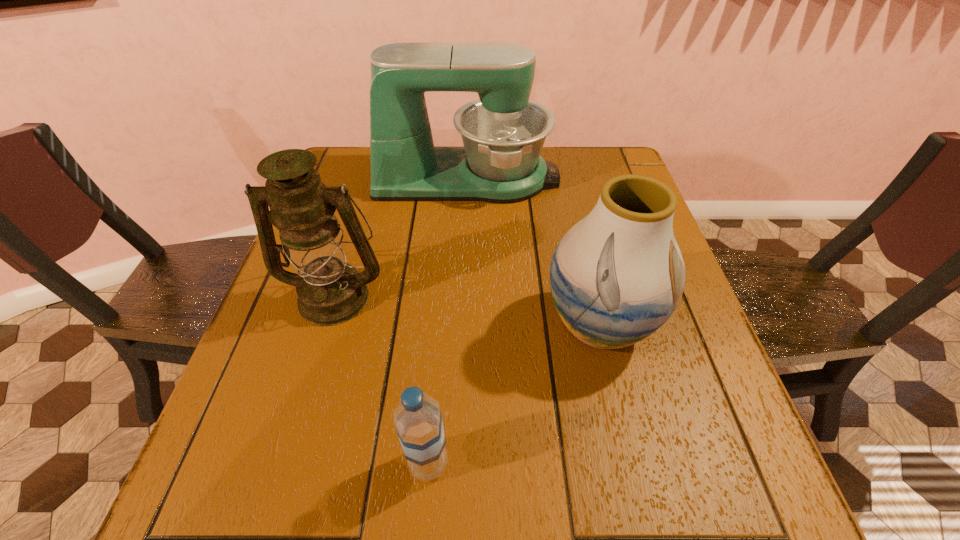
Image resolution: width=960 pixels, height=540 pixels. What are the coordinates of `vacant area in the image that satisfies the following two spatial constraints: 1. on the back side of the vase; 2. on the front-facing side of the farthest object` in the screenshot? It's located at (564, 178).

You are a GUI agent. You are given a task and a screenshot of the screen. Output one action in this format:
    pyautogui.click(x=<x>, y=<y>)
    Task: Click on the vacant space that satisfies the following two spatial constraints: 1. on the front-facing side of the mixer; 2. on the front side of the oil lamp
    Image resolution: width=960 pixels, height=540 pixels.
    Given the screenshot: What is the action you would take?
    pyautogui.click(x=463, y=296)

You are a GUI agent. You are given a task and a screenshot of the screen. Output one action in this format:
    pyautogui.click(x=<x>, y=<y>)
    Task: Click on the free location that satisfies the following two spatial constraints: 1. on the front-facing side of the farthest object; 2. on the left side of the vase
    The height and width of the screenshot is (540, 960).
    Given the screenshot: What is the action you would take?
    pyautogui.click(x=462, y=326)

You are a GUI agent. You are given a task and a screenshot of the screen. Output one action in this format:
    pyautogui.click(x=<x>, y=<y>)
    Task: Click on the vacant space that satisfies the following two spatial constraints: 1. on the front-facing side of the vase; 2. on the left side of the farthest object
    The height and width of the screenshot is (540, 960).
    Given the screenshot: What is the action you would take?
    pyautogui.click(x=462, y=326)